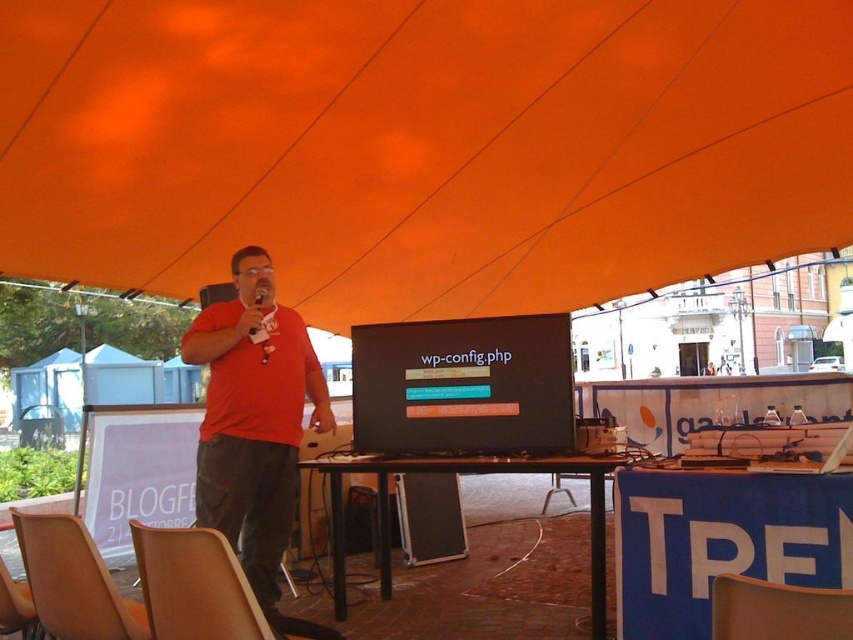
Question: Is black wooden table at center to the left of matte orange chair at lower right from the viewer's perspective?

Choices:
 (A) yes
 (B) no

Answer: (A)

Question: Which object is farther from the camera taking this photo?

Choices:
 (A) leather at center
 (B) light brown wood chair at lower left

Answer: (A)

Question: Among these points, which one is farthest from the camera?

Choices:
 (A) (492, 349)
 (B) (129, 634)
 (C) (15, 620)
 (D) (795, 218)

Answer: (D)

Question: Which of the following is the farthest from the observer?

Choices:
 (A) [x=70, y=628]
 (B) [x=258, y=332]
 (C) [x=782, y=608]

Answer: (B)

Question: Is orange fabric canopy at upper center positioned in front of brown leather chair at lower left?

Choices:
 (A) yes
 (B) no

Answer: (B)

Question: Can you confirm if orange fabric canopy at upper center is positioned below matte red shirt at center?

Choices:
 (A) no
 (B) yes

Answer: (A)